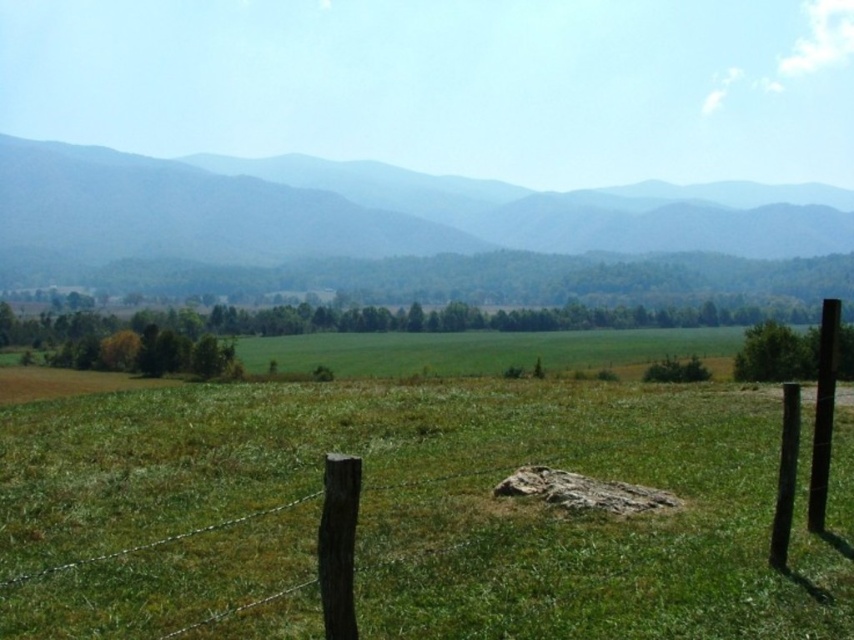
Question: Which point appears closest to the camera in this image?

Choices:
 (A) (4, 211)
 (B) (823, 314)

Answer: (B)

Question: Is green forested mountain at upper center positioned before black smooth pole at right?

Choices:
 (A) yes
 (B) no

Answer: (B)

Question: Can you confirm if green forested mountain at upper center is wider than black smooth pole at right?

Choices:
 (A) no
 (B) yes

Answer: (B)

Question: Among these objects, which one is farthest from the camera?

Choices:
 (A) black smooth pole at right
 (B) green forested mountain at upper center

Answer: (B)

Question: Can you confirm if green forested mountain at upper center is positioned below black smooth pole at right?

Choices:
 (A) no
 (B) yes

Answer: (A)

Question: Among these objects, which one is nearest to the camera?

Choices:
 (A) green forested mountain at upper center
 (B) black smooth pole at right

Answer: (B)